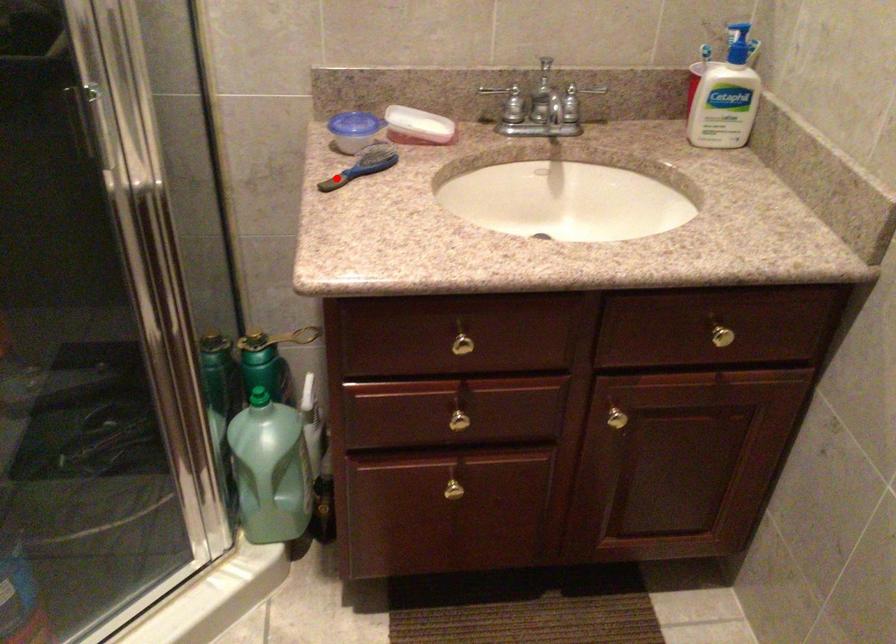
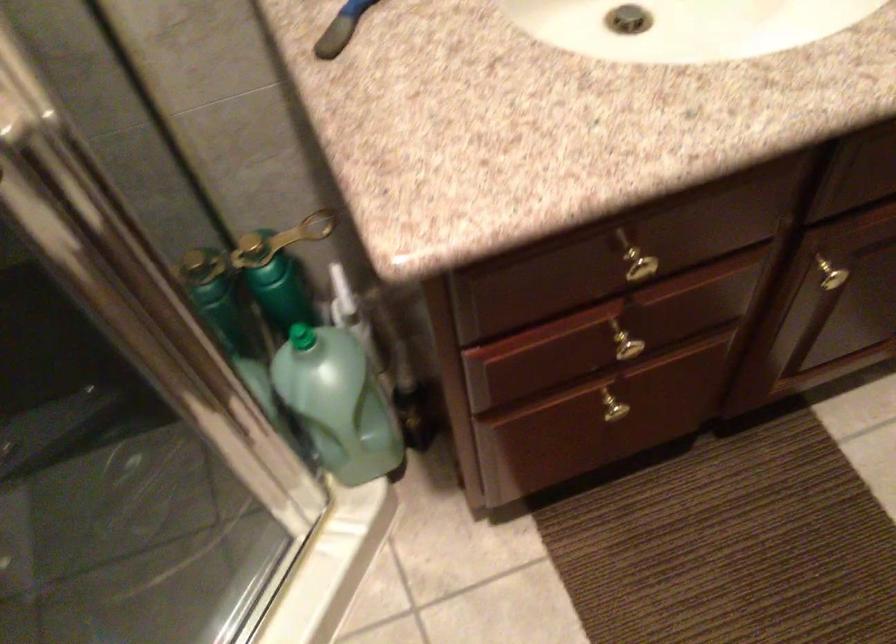
Locate, in the second image, the point that corresponds to the highlighted location in the first image.

(340, 29)